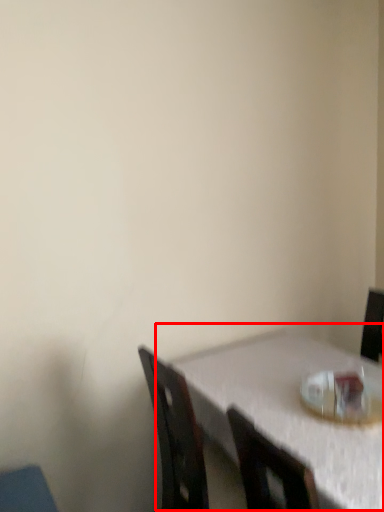
Question: In this image, where is table (annotated by the red box) located relative to tableware?

Choices:
 (A) right
 (B) left

Answer: (B)